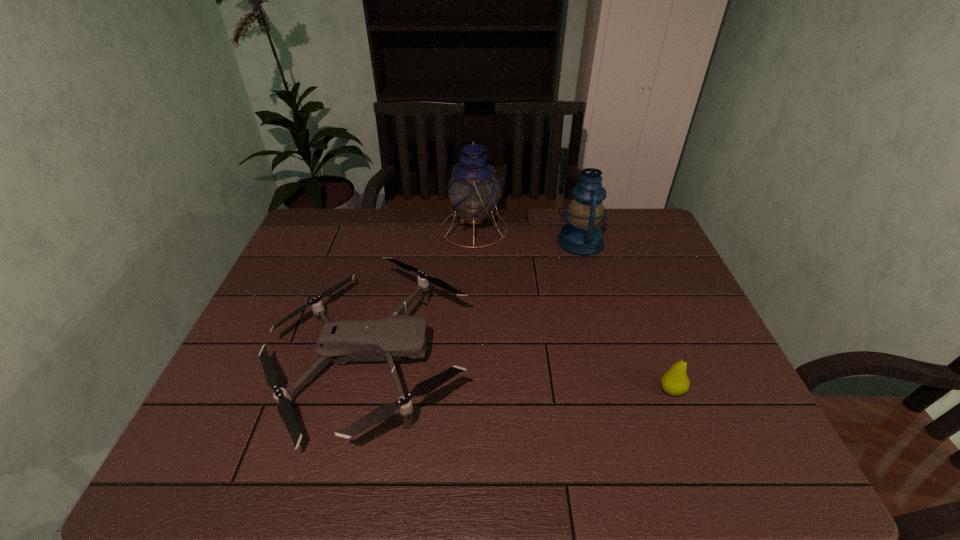
The image size is (960, 540). Find the location of `object that is the third closest one to the rightmost object`. object that is the third closest one to the rightmost object is located at coordinates (473, 190).

The width and height of the screenshot is (960, 540). I want to click on object that ranks as the second closest to the taller lantern, so click(389, 339).

What are the coordinates of `free space that satisfies the following two spatial constraints: 1. on the front-facing side of the pear; 2. on the right side of the drone` in the screenshot? It's located at (364, 390).

Locate an element on the screen. The height and width of the screenshot is (540, 960). free space in the image that satisfies the following two spatial constraints: 1. on the face of the pear; 2. on the right side of the shorter lantern is located at coordinates (623, 390).

This screenshot has height=540, width=960. Identify the location of vacant point that satisfies the following two spatial constraints: 1. on the front-facing side of the pear; 2. on the right side of the tallest object. (471, 390).

Where is `vacant area that satisfies the following two spatial constraints: 1. on the front-facing side of the pear; 2. on the right side of the drone`? vacant area that satisfies the following two spatial constraints: 1. on the front-facing side of the pear; 2. on the right side of the drone is located at coordinates 364,390.

Where is `free space in the image that satisfies the following two spatial constraints: 1. on the front-facing side of the rightmost object; 2. on the left side of the drone`? This screenshot has height=540, width=960. free space in the image that satisfies the following two spatial constraints: 1. on the front-facing side of the rightmost object; 2. on the left side of the drone is located at coordinates (364, 390).

Find the location of a particular element. The width and height of the screenshot is (960, 540). vacant space that satisfies the following two spatial constraints: 1. on the back side of the rightmost object; 2. on the front-facing side of the drone is located at coordinates (660, 359).

Locate an element on the screen. The height and width of the screenshot is (540, 960). vacant area in the image that satisfies the following two spatial constraints: 1. on the back side of the pear; 2. on the front-facing side of the taller lantern is located at coordinates (610, 228).

Where is `vacant space that satisfies the following two spatial constraints: 1. on the back side of the rightmost object; 2. on the face of the right lantern`? vacant space that satisfies the following two spatial constraints: 1. on the back side of the rightmost object; 2. on the face of the right lantern is located at coordinates (614, 242).